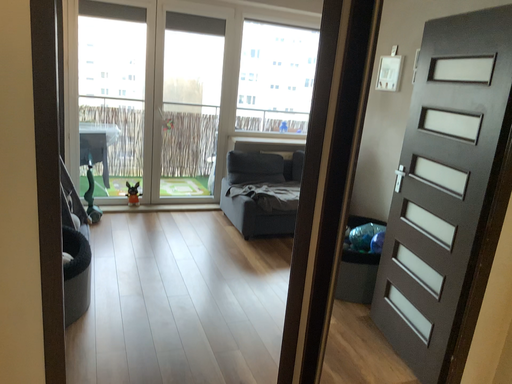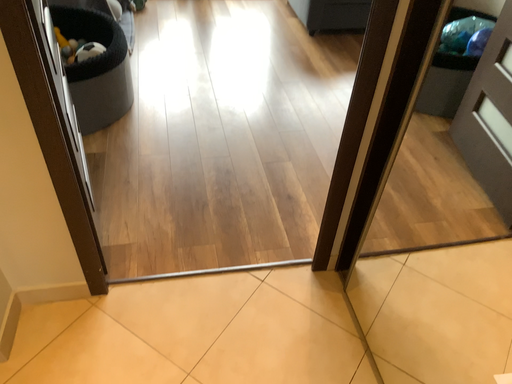
Question: Which way did the camera rotate in the video?

Choices:
 (A) rotated left
 (B) rotated right

Answer: (A)